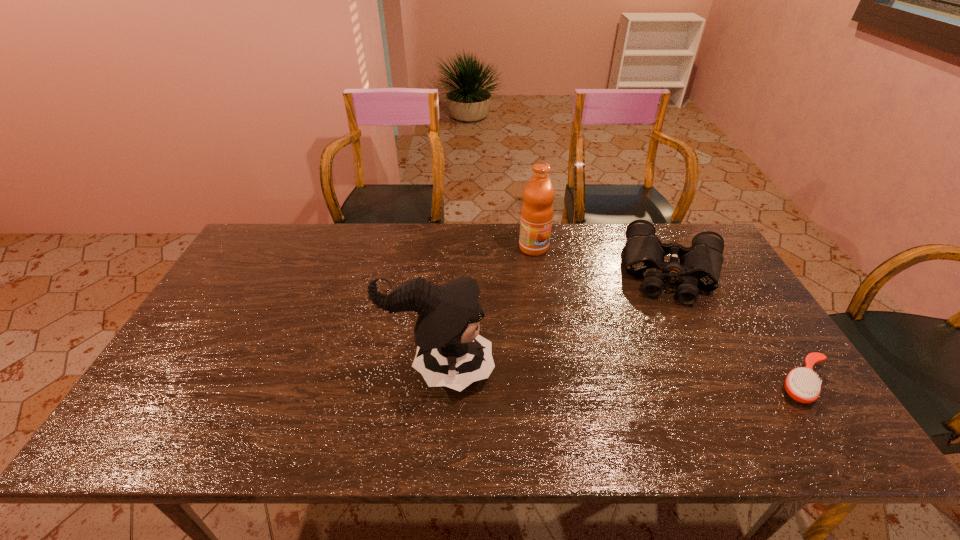
Where is `vacant region located 0.300m on the label side of the second object from left to right`? vacant region located 0.300m on the label side of the second object from left to right is located at coordinates (604, 313).

Find the location of `vacant space located 0.190m on the label side of the second object from left to right`. vacant space located 0.190m on the label side of the second object from left to right is located at coordinates (579, 290).

This screenshot has height=540, width=960. Identify the location of binoculars that is at the far edge. click(699, 266).

Find the location of a particular element. fruit juice that is at the far edge is located at coordinates (537, 210).

You are a GUI agent. You are given a task and a screenshot of the screen. Output one action in this format:
    pyautogui.click(x=<x>, y=<y>)
    Task: Click on the doll at the near edge
    The width and height of the screenshot is (960, 540).
    Given the screenshot: What is the action you would take?
    pyautogui.click(x=450, y=352)

Image resolution: width=960 pixels, height=540 pixels. In order to click on hairbrush located in the near edge section of the desktop in this screenshot , I will do `click(802, 384)`.

At what (x,y) coordinates should I click in order to perform the action: click on hairbrush that is positioned at the right edge. Please return your answer as a coordinate pair (x, y). This screenshot has height=540, width=960. Looking at the image, I should click on (802, 384).

The width and height of the screenshot is (960, 540). What are the coordinates of `binoculars present at the right edge` in the screenshot? It's located at (699, 266).

Where is `object situated at the far right corner`? object situated at the far right corner is located at coordinates (x=699, y=266).

Locate an element on the screen. The height and width of the screenshot is (540, 960). object at the near right corner is located at coordinates (802, 384).